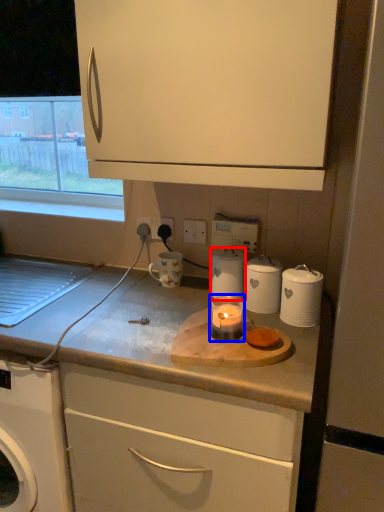
Question: Among these objects, which one is farthest to the camera, kitchen appliance (highlighted by a red box) or candle holder (highlighted by a blue box)?

Choices:
 (A) kitchen appliance
 (B) candle holder

Answer: (A)